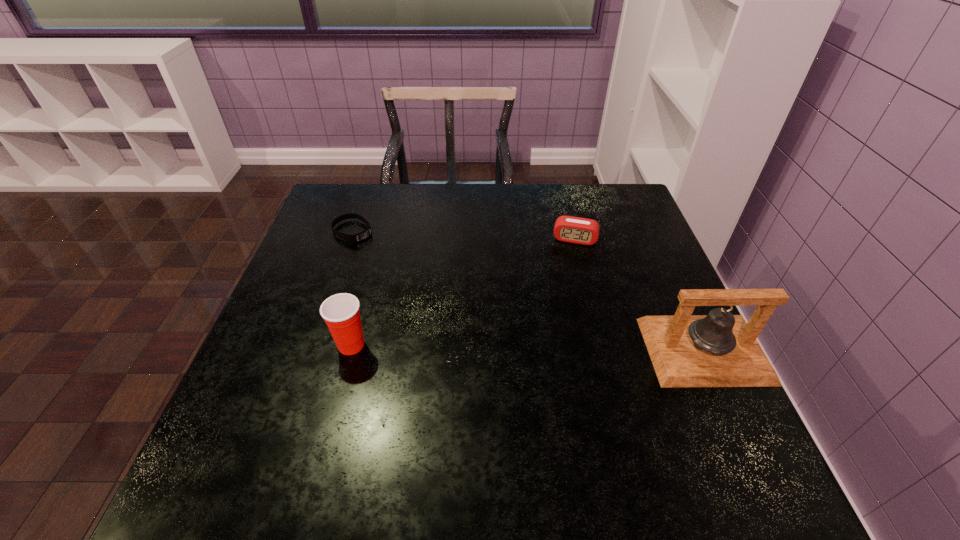
You are a GUI agent. You are given a task and a screenshot of the screen. Output one action in this format:
    pyautogui.click(x=<x>, y=<y>)
    Task: Click on the free area in between the alarm clock and the third shortest object
    The height and width of the screenshot is (540, 960).
    Given the screenshot: What is the action you would take?
    click(x=463, y=292)

In order to click on blank region between the third object from left to right and the wristband in this screenshot , I will do `click(464, 235)`.

This screenshot has width=960, height=540. What are the coordinates of `vacant area that lies between the bell and the second tallest object` in the screenshot? It's located at (528, 348).

Locate an element on the screen. free space between the shortest object and the third shortest object is located at coordinates (352, 288).

Where is `vacant area that lies between the wristband and the third shortest object`? vacant area that lies between the wristband and the third shortest object is located at coordinates (352, 288).

The width and height of the screenshot is (960, 540). I want to click on free spot between the Dixie cup and the alarm clock, so click(463, 292).

Select which object is the closest to the shortest object. Please provide its 2D coordinates. Your answer should be formatted as a tuple, i.e. [(x, y)], where the tuple contains the x and y coordinates of a point satisfying the conditions above.

[(341, 313)]

You are a GUI agent. You are given a task and a screenshot of the screen. Output one action in this format:
    pyautogui.click(x=<x>, y=<y>)
    Task: Click on the object that ranks as the third closest to the tallest object
    This screenshot has width=960, height=540.
    Given the screenshot: What is the action you would take?
    click(355, 238)

You are a GUI agent. You are given a task and a screenshot of the screen. Output one action in this format:
    pyautogui.click(x=<x>, y=<y>)
    Task: Click on the vacant space that satisfies the following two spatial constraints: 1. on the front side of the second object from right to left; 2. on the left side of the tallest object
    The width and height of the screenshot is (960, 540).
    Given the screenshot: What is the action you would take?
    pyautogui.click(x=603, y=350)

Find the location of a particular element. This screenshot has height=540, width=960. vacant space that satisfies the following two spatial constraints: 1. on the front side of the shortest object; 2. on the left side of the Dixie cup is located at coordinates (313, 345).